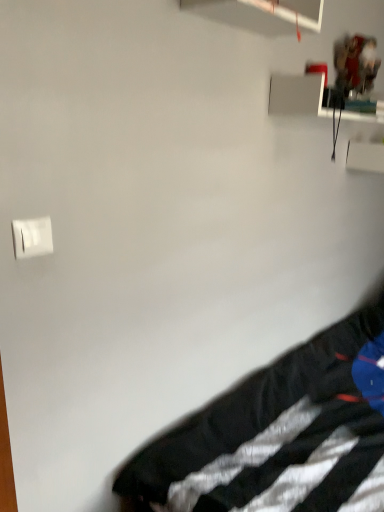
Describe the element at coordinates (32, 237) in the screenshot. I see `white plastic light switch at upper left` at that location.

Image resolution: width=384 pixels, height=512 pixels. I want to click on white plastic light switch at upper left, so click(32, 237).

The height and width of the screenshot is (512, 384). In order to click on black fabric at lower right in this screenshot , I will do `click(281, 434)`.

Describe the element at coordinates (281, 434) in the screenshot. The image size is (384, 512). I see `black fabric at lower right` at that location.

Locate an element on the screen. The width and height of the screenshot is (384, 512). white plastic light switch at upper left is located at coordinates (32, 237).

Considering the relative positions of black fabric at lower right and white plastic light switch at upper left in the image provided, is black fabric at lower right to the right of white plastic light switch at upper left from the viewer's perspective?

Indeed, black fabric at lower right is positioned on the right side of white plastic light switch at upper left.

Which object is further away from the camera taking this photo, black fabric at lower right or white plastic light switch at upper left?

white plastic light switch at upper left is further away from the camera.

Which is closer, (213,436) or (32,223)?

Positioned in front is point (32,223).

From the image's perspective, which is below, black fabric at lower right or white plastic light switch at upper left?

black fabric at lower right, from the image's perspective.

From a real-world perspective, who is located higher, black fabric at lower right or white plastic light switch at upper left?

white plastic light switch at upper left is physically above.

Does black fabric at lower right have a greater width compared to white plastic light switch at upper left?

Yes.

Is black fabric at lower right taller or shorter than white plastic light switch at upper left?

In the image, black fabric at lower right appears to be taller than white plastic light switch at upper left.

Considering the relative sizes of black fabric at lower right and white plastic light switch at upper left in the image provided, is black fabric at lower right bigger than white plastic light switch at upper left?

Indeed, black fabric at lower right has a larger size compared to white plastic light switch at upper left.

Is white plastic light switch at upper left surrounded by black fabric at lower right?

No, white plastic light switch at upper left is not a part of black fabric at lower right.

Is black fabric at lower right positioned far away from white plastic light switch at upper left?

No, black fabric at lower right is in close proximity to white plastic light switch at upper left.

Is black fabric at lower right aimed at white plastic light switch at upper left?

No, black fabric at lower right is not facing towards white plastic light switch at upper left.

How many degrees apart are the facing directions of black fabric at lower right and white plastic light switch at upper left?

They differ by 88.3 degrees in their facing directions.

Where is `furniture below the white plastic light switch at upper left (from a real-world perspective)`? furniture below the white plastic light switch at upper left (from a real-world perspective) is located at coordinates (281, 434).

Considering the positions of objects white plastic light switch at upper left and black fabric at lower right in the image provided, who is more to the left, white plastic light switch at upper left or black fabric at lower right?

white plastic light switch at upper left is more to the left.

Is white plastic light switch at upper left in front of or behind black fabric at lower right in the image?

Visually, white plastic light switch at upper left is located behind black fabric at lower right.

Which is closer to the camera, (x=49, y=228) or (x=370, y=338)?

Clearly, point (x=49, y=228) is closer to the camera than point (x=370, y=338).

From the image's perspective, is white plastic light switch at upper left over black fabric at lower right?

Yes.

From a real-world perspective, is white plastic light switch at upper left located higher than black fabric at lower right?

Correct, in the physical world, white plastic light switch at upper left is higher than black fabric at lower right.

Considering the sizes of white plastic light switch at upper left and black fabric at lower right in the image, is white plastic light switch at upper left wider or thinner than black fabric at lower right?

Clearly, white plastic light switch at upper left has less width compared to black fabric at lower right.

Does white plastic light switch at upper left have a greater height compared to black fabric at lower right?

No.

In terms of size, does white plastic light switch at upper left appear bigger or smaller than black fabric at lower right?

white plastic light switch at upper left is smaller than black fabric at lower right.

Is white plastic light switch at upper left situated inside black fabric at lower right or outside?

white plastic light switch at upper left lies outside black fabric at lower right.

Are white plastic light switch at upper left and black fabric at lower right making contact?

No, white plastic light switch at upper left is not beside black fabric at lower right.

Is white plastic light switch at upper left looking in the opposite direction of black fabric at lower right?

No, black fabric at lower right is not at the back of white plastic light switch at upper left.

What's the angular difference between white plastic light switch at upper left and black fabric at lower right's facing directions?

There is a 88.3-degree angle between the facing directions of white plastic light switch at upper left and black fabric at lower right.

The width and height of the screenshot is (384, 512). Identify the location of light switch behind the black fabric at lower right. (32, 237).

At what (x,y) coordinates should I click in order to perform the action: click on light switch behind the black fabric at lower right. Please return your answer as a coordinate pair (x, y). The height and width of the screenshot is (512, 384). Looking at the image, I should click on (32, 237).

There is a black fabric at lower right. Identify the location of light switch above it (from a real-world perspective). Image resolution: width=384 pixels, height=512 pixels. (32, 237).